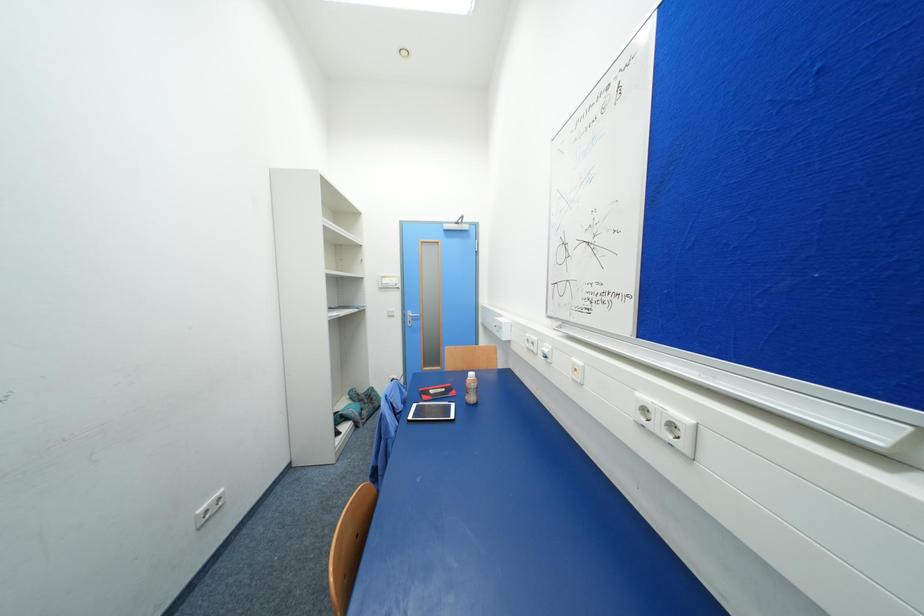
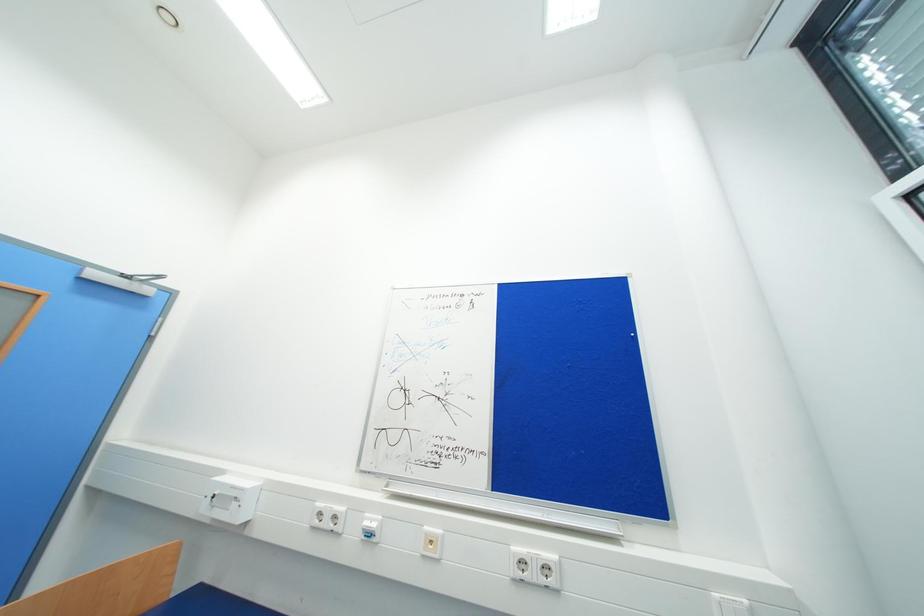
How did the camera likely rotate?

The camera rotated toward right-up.